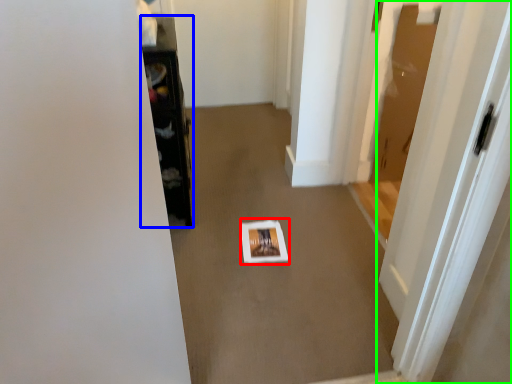
Question: Considering the real-world distances, which object is farthest from square (highlighted by a red box)? furniture (highlighted by a blue box) or door (highlighted by a green box)?

Choices:
 (A) furniture
 (B) door

Answer: (B)